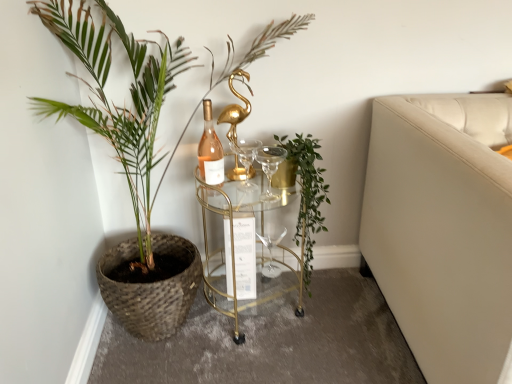
Question: Is transparent glass wine glass at center, which is the first wine glass in back-to-front order, at the left side of matte glass wine bottle at center?

Choices:
 (A) no
 (B) yes

Answer: (A)

Question: From the image's perspective, is transparent glass wine glass at center, which is the first wine glass in back-to-front order, beneath matte glass wine bottle at center?

Choices:
 (A) no
 (B) yes

Answer: (B)

Question: Does transparent glass wine glass at center, positioned as the 2th wine glass in top-to-bottom order, have a lesser width compared to matte glass wine bottle at center?

Choices:
 (A) no
 (B) yes

Answer: (A)

Question: From the image's perspective, is transparent glass wine glass at center, which is the first wine glass in bottom-to-top order, above matte glass wine bottle at center?

Choices:
 (A) yes
 (B) no

Answer: (B)

Question: Is transparent glass wine glass at center, which is the first wine glass in bottom-to-top order, oriented towards matte glass wine bottle at center?

Choices:
 (A) yes
 (B) no

Answer: (B)

Question: Is transparent glass wine glass at center, which is the first wine glass in bottom-to-top order, closer to camera compared to matte glass wine bottle at center?

Choices:
 (A) yes
 (B) no

Answer: (B)

Question: Can you confirm if transparent glass wine glass at center, which is the first wine glass in back-to-front order, is smaller than clear glass wine glass at center, which is the second wine glass in back-to-front order?

Choices:
 (A) yes
 (B) no

Answer: (B)

Question: Is transparent glass wine glass at center, positioned as the 2th wine glass in top-to-bottom order, aimed at clear glass wine glass at center, the 1th wine glass viewed from the top?

Choices:
 (A) yes
 (B) no

Answer: (B)

Question: Does transparent glass wine glass at center, which is the first wine glass in bottom-to-top order, appear on the left side of clear glass wine glass at center, the 2th wine glass ordered from the bottom?

Choices:
 (A) yes
 (B) no

Answer: (B)

Question: Considering the relative positions of transparent glass wine glass at center, which is the first wine glass in bottom-to-top order, and clear glass wine glass at center, the 1th wine glass viewed from the top, in the image provided, is transparent glass wine glass at center, which is the first wine glass in bottom-to-top order, in front of clear glass wine glass at center, the 1th wine glass viewed from the top,?

Choices:
 (A) no
 (B) yes

Answer: (A)

Question: Is transparent glass wine glass at center, which is the first wine glass in back-to-front order, at the right side of clear glass wine glass at center, the 2th wine glass ordered from the bottom?

Choices:
 (A) yes
 (B) no

Answer: (A)

Question: Is transparent glass wine glass at center, which is the first wine glass in bottom-to-top order, thinner than clear glass wine glass at center, the 1th wine glass viewed from the top?

Choices:
 (A) no
 (B) yes

Answer: (A)

Question: From a real-world perspective, is matte glass wine bottle at center physically above transparent glass wine glass at center, which is the first wine glass in back-to-front order?

Choices:
 (A) no
 (B) yes

Answer: (B)